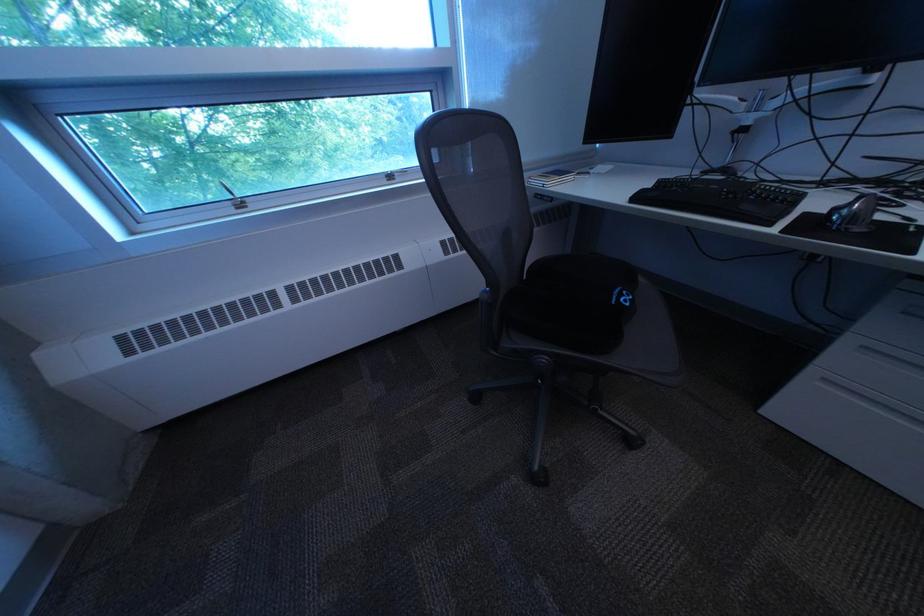
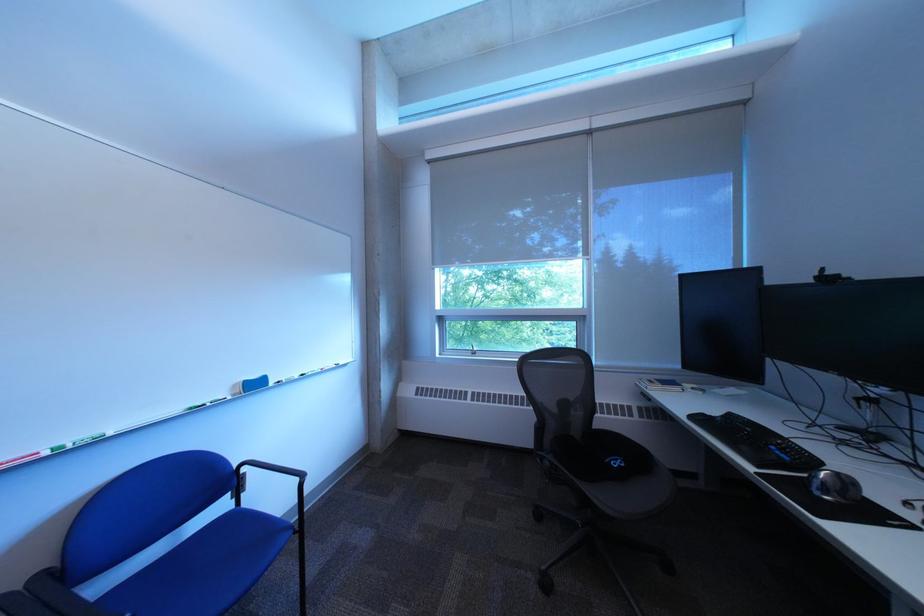
Locate, in the second image, the point that corresponds to (650,200) in the first image.

(708, 419)